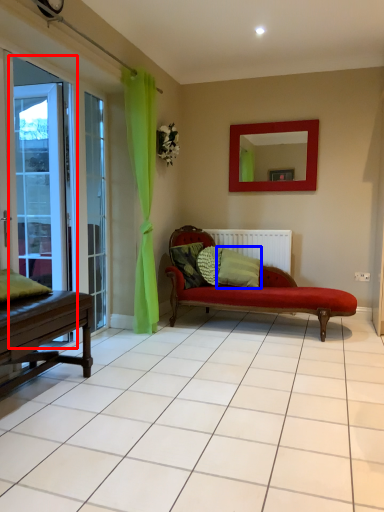
Question: Among these objects, which one is nearest to the camera, screen door (highlighted by a red box) or pillow (highlighted by a blue box)?

Choices:
 (A) screen door
 (B) pillow

Answer: (A)